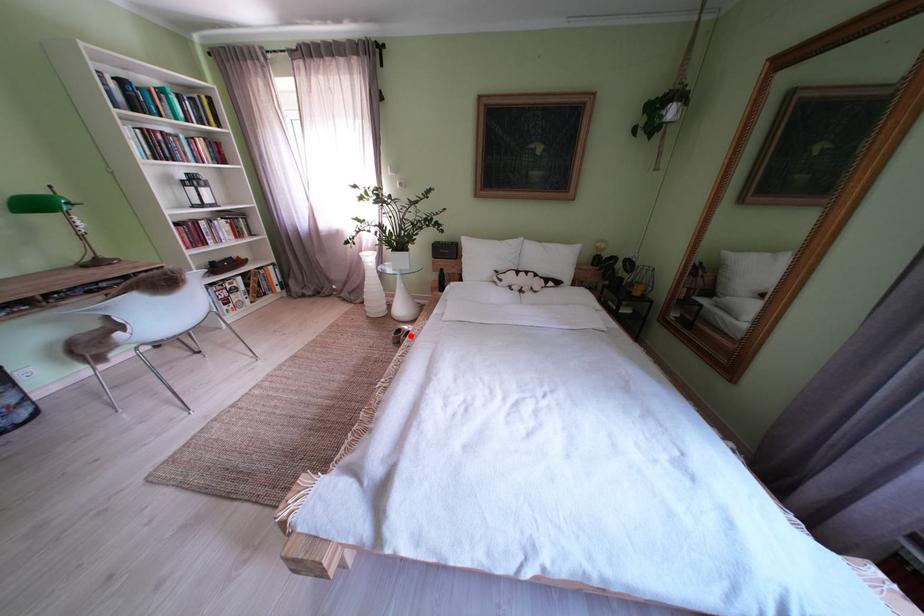
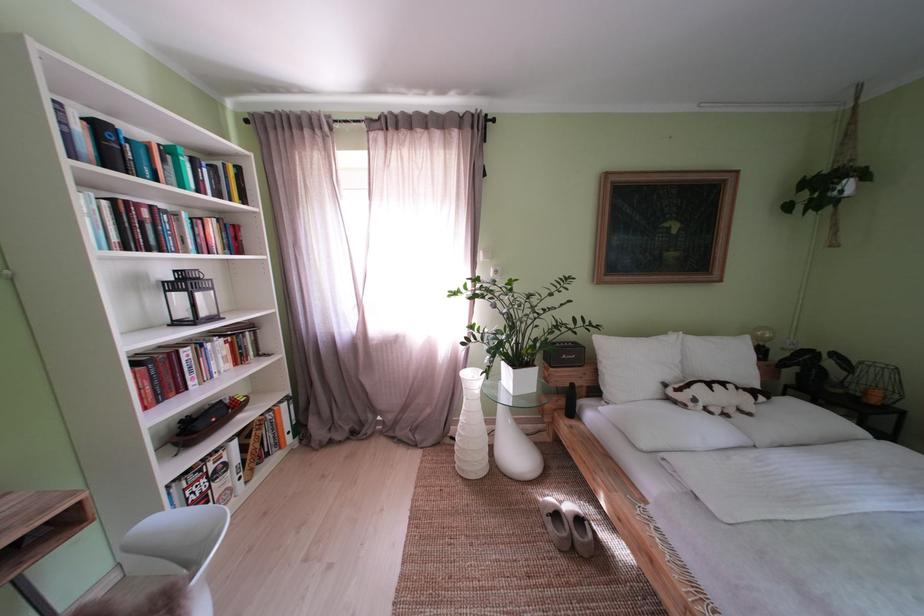
In the second image, find the point that corresponds to the highlighted location in the first image.

(567, 521)